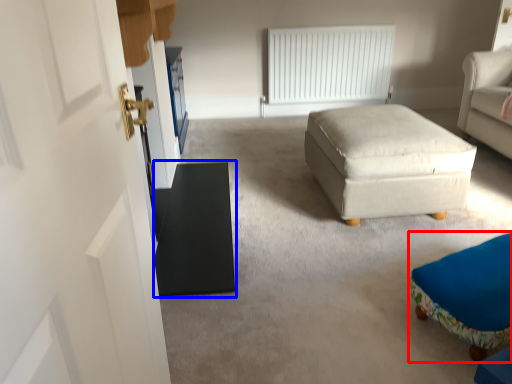
Question: Which point is closer to the camera, furniture (highlighted by a red box) or table (highlighted by a blue box)?

Choices:
 (A) furniture
 (B) table

Answer: (A)